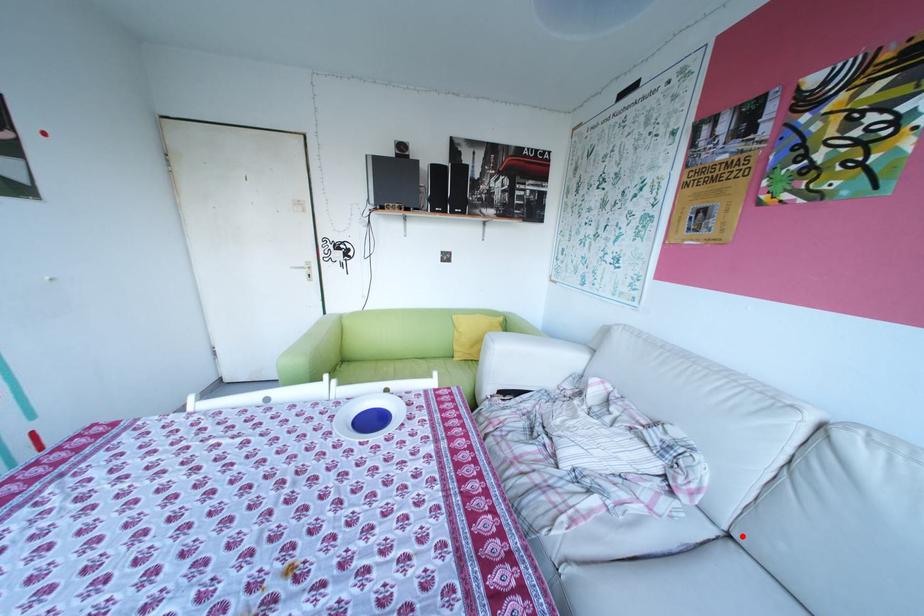
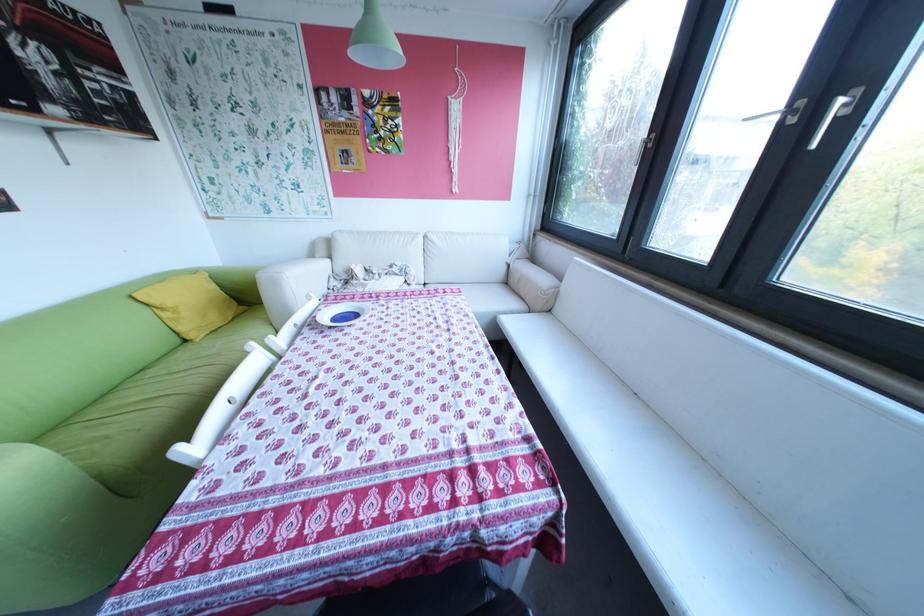
Locate, in the second image, the point that corresponds to the highlighted location in the first image.

(438, 284)